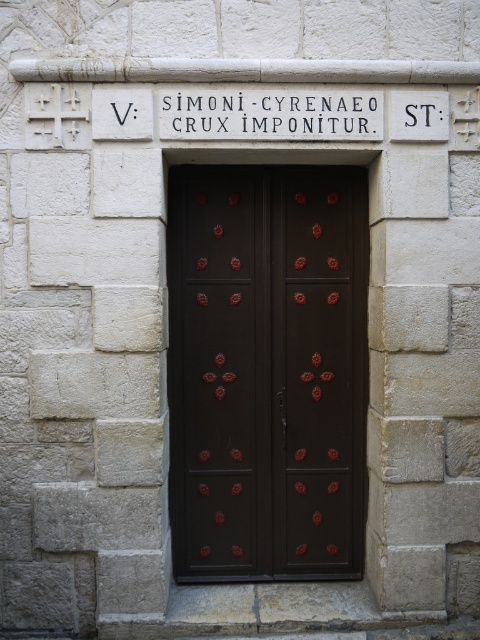
You are standing in front of the stone wall with the wooden door and the plaque. You notice two points marked on the wall. The first point is at coordinates point (245,321) and the second is at point (360,122). From your perspective, which point is closer to you?

Point (360,122) is closer to you because point (245,321) is behind it.

You are standing in front of a historic stone wall with a door and a sign. You need to locate the dark wood door at center and the white stone sign at center. According to their positions, which object is positioned to the left from your perspective?

The dark wood door at center is to the left of the white stone sign at center, so the dark wood door at center is positioned to the left.